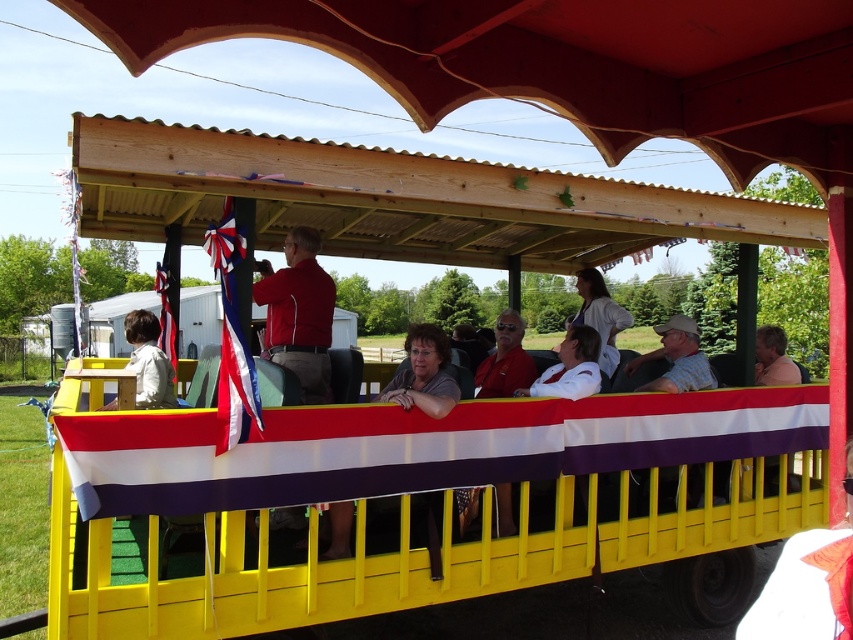
You are a photographer standing near the parade float. You want to take a photo of the red smooth jacket at center and the light beige jacket at left together in the frame. The minimum distance between them to fit in your camera lens is 35 inches. Can you capture both jackets in one shot?

The distance between the red smooth jacket at center and the light beige jacket at left is 36.14 inches, which exceeds the minimum required distance of 35 inches. Therefore, you can capture both jackets in one shot.

You are a photographer standing in front of the yellow vehicle. You notice two people wearing the plaid shirt at center and the white fabric shirt at center. Which one is positioned more to the right side?

The plaid shirt at center is positioned more to the right side than the white fabric shirt at center.

You are standing at the center of the image and want to locate the orange fabric at lower right. Which direction should you look to find it?

The orange fabric at lower right is located at point (808, 582), so you should look to the lower right direction to find it.